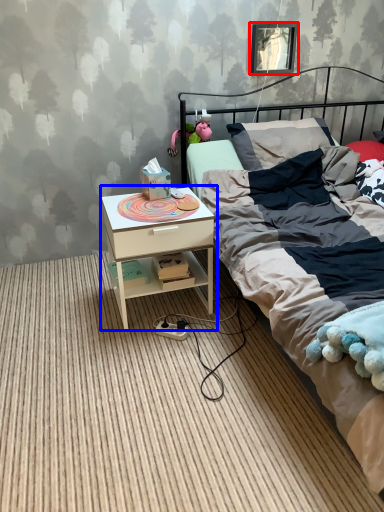
Question: Which point is closer to the camera, picture frame (highlighted by a red box) or nightstand (highlighted by a blue box)?

Choices:
 (A) picture frame
 (B) nightstand

Answer: (B)